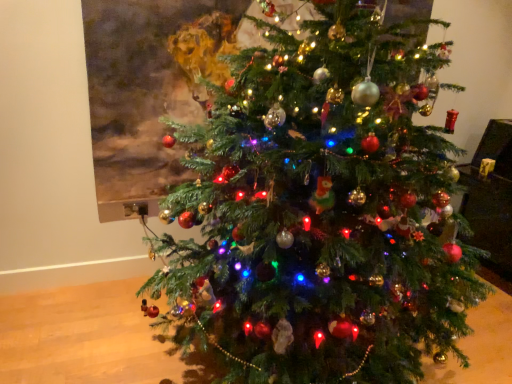
What is the approximate width of green matte christmas tree at center?

green matte christmas tree at center is 5.37 feet wide.

What do you see at coordinates (321, 210) in the screenshot?
I see `green matte christmas tree at center` at bounding box center [321, 210].

Locate an element on the screen. This screenshot has height=384, width=512. green matte christmas tree at center is located at coordinates (321, 210).

Where is `green matte christmas tree at center`? green matte christmas tree at center is located at coordinates (321, 210).